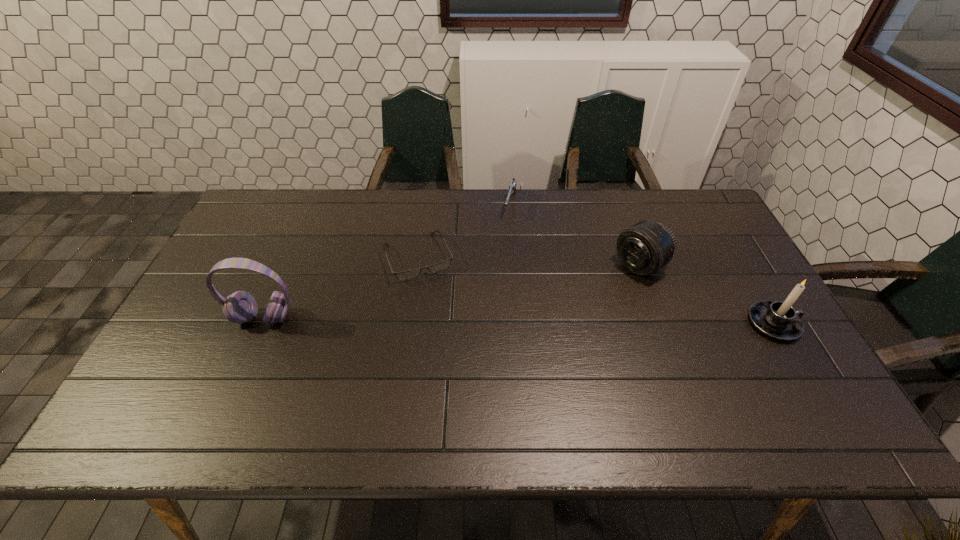
Find the location of a particular element. The image size is (960, 540). vacant space in between the rightmost object and the spectacles is located at coordinates coord(596,291).

Where is `free space between the tallest object and the third object from right to left`? free space between the tallest object and the third object from right to left is located at coordinates (387, 261).

I want to click on empty location between the spectacles and the leftmost object, so click(342, 288).

I want to click on free area in between the fourth tallest object and the third tallest object, so point(575,235).

The width and height of the screenshot is (960, 540). In order to click on free area in between the headset and the shortest object in this screenshot , I will do `click(342, 288)`.

Identify the location of vacant area between the pistol and the third shortest object. Image resolution: width=960 pixels, height=540 pixels. (575, 235).

Identify which object is the fourth nearest to the tallest object. Please provide its 2D coordinates. Your answer should be formatted as a tuple, i.e. [(x, y)], where the tuple contains the x and y coordinates of a point satisfying the conditions above.

[(779, 320)]

The width and height of the screenshot is (960, 540). Find the location of `object that can be found as the third closest to the third object from left to right`. object that can be found as the third closest to the third object from left to right is located at coordinates (240, 307).

Where is `blank area in the image that satisfies the following two spatial constraints: 1. on the headband and ear cups of the tallest object; 2. with a handle on the side of the rightmost object`? The width and height of the screenshot is (960, 540). blank area in the image that satisfies the following two spatial constraints: 1. on the headband and ear cups of the tallest object; 2. with a handle on the side of the rightmost object is located at coordinates (261, 323).

Identify the location of vacant region that satisfies the following two spatial constraints: 1. on the headband and ear cups of the tallest object; 2. with a handle on the side of the candle holder. This screenshot has height=540, width=960. (261, 323).